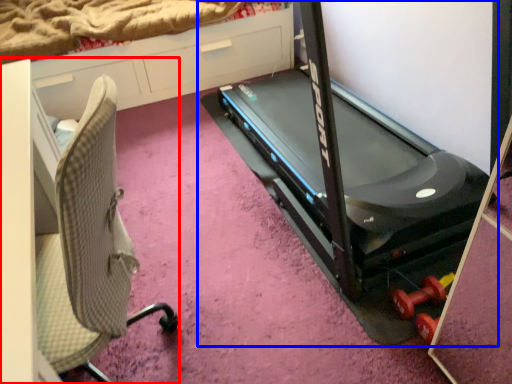
Question: Which point is further to the camera, furniture (highlighted by a red box) or treadmill (highlighted by a blue box)?

Choices:
 (A) furniture
 (B) treadmill

Answer: (B)